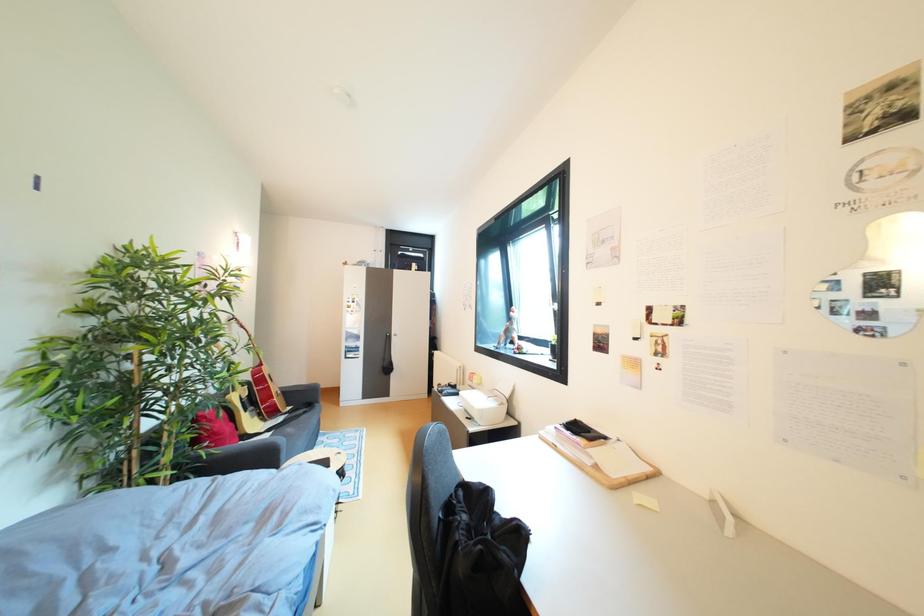
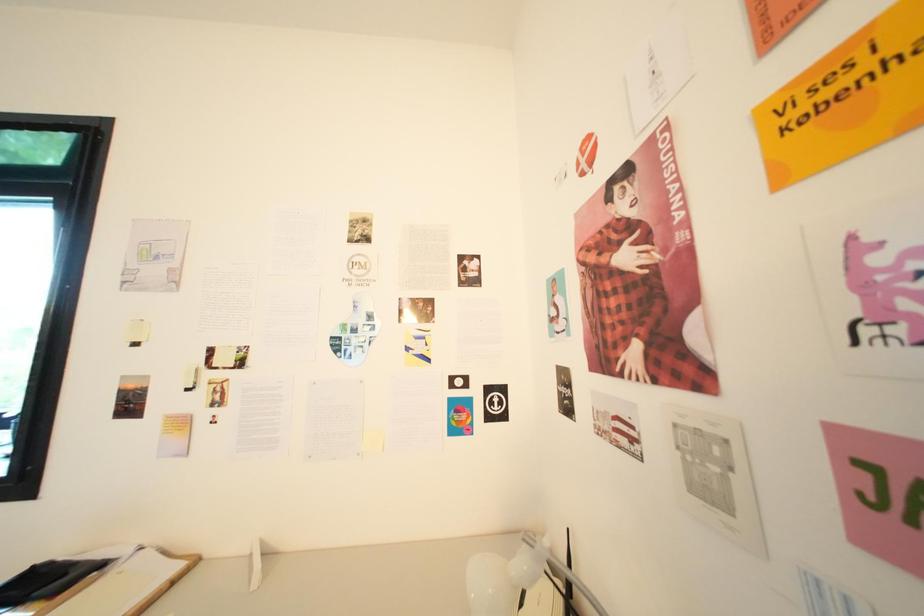
Question: Based on the continuous images, in which direction is the camera rotating? Reply with the corresponding letter.

Choices:
 (A) Left
 (B) Right
 (C) Up
 (D) Down

Answer: (B)